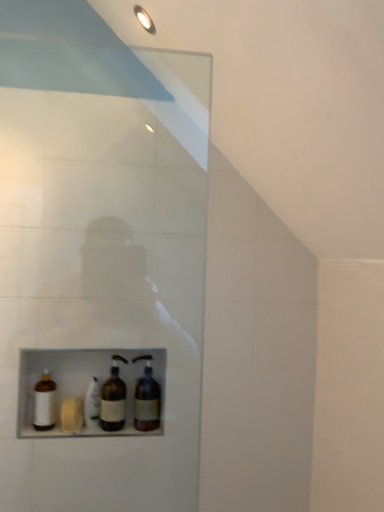
Question: Would you consider white matte bottle at center, acting as the third bottle starting from the right, to be distant from brown glass bottle at center, which is counted as the third bottle, starting from the left?

Choices:
 (A) yes
 (B) no

Answer: (B)

Question: Is brown glass bottle at center, which appears as the second bottle when viewed from the right, completely or partially inside white matte bottle at center, the second bottle from the left?

Choices:
 (A) no
 (B) yes

Answer: (A)

Question: Is white matte bottle at center, acting as the third bottle starting from the right, facing towards brown glass bottle at center, which appears as the second bottle when viewed from the right?

Choices:
 (A) yes
 (B) no

Answer: (B)

Question: Considering the relative sizes of white matte bottle at center, the second bottle from the left, and brown glass bottle at center, which appears as the second bottle when viewed from the right, in the image provided, is white matte bottle at center, the second bottle from the left, shorter than brown glass bottle at center, which appears as the second bottle when viewed from the right,?

Choices:
 (A) no
 (B) yes

Answer: (B)

Question: Does white matte bottle at center, acting as the third bottle starting from the right, have a smaller size compared to brown glass bottle at center, which appears as the second bottle when viewed from the right?

Choices:
 (A) yes
 (B) no

Answer: (A)

Question: Considering their positions, is white matte bottle at center, the second bottle from the left, located in front of or behind brown glass bottle at center, which is counted as the third bottle, starting from the left?

Choices:
 (A) behind
 (B) front

Answer: (A)

Question: Is white matte bottle at center, acting as the third bottle starting from the right, bigger or smaller than brown glass bottle at center, which is counted as the third bottle, starting from the left?

Choices:
 (A) small
 (B) big

Answer: (A)

Question: In the image, is white matte bottle at center, acting as the third bottle starting from the right, on the left side or the right side of brown glass bottle at center, which is counted as the third bottle, starting from the left?

Choices:
 (A) right
 (B) left

Answer: (B)

Question: Is white matte bottle at center, the second bottle from the left, situated inside brown glass bottle at center, which is counted as the third bottle, starting from the left, or outside?

Choices:
 (A) outside
 (B) inside

Answer: (A)

Question: From a real-world perspective, is white matte bottle at lower left, marked as the first bottle in a left-to-right arrangement, physically located above or below white matte bottle at center, the second bottle from the left?

Choices:
 (A) above
 (B) below

Answer: (A)

Question: Considering their positions, is white matte bottle at lower left, marked as the first bottle in a left-to-right arrangement, located in front of or behind white matte bottle at center, the second bottle from the left?

Choices:
 (A) front
 (B) behind

Answer: (A)

Question: Is white matte bottle at lower left, marked as the first bottle in a left-to-right arrangement, taller or shorter than white matte bottle at center, the second bottle from the left?

Choices:
 (A) tall
 (B) short

Answer: (B)

Question: Looking at the image, does white matte bottle at lower left, which is counted as the 4th bottle, starting from the right, seem bigger or smaller compared to white matte bottle at center, the second bottle from the left?

Choices:
 (A) big
 (B) small

Answer: (B)

Question: Considering their positions, is white matte bottle at center, acting as the third bottle starting from the right, located in front of or behind white matte bottle at lower left, marked as the first bottle in a left-to-right arrangement?

Choices:
 (A) front
 (B) behind

Answer: (B)

Question: From the image's perspective, is white matte bottle at center, the second bottle from the left, above or below white matte bottle at lower left, which is counted as the 4th bottle, starting from the right?

Choices:
 (A) above
 (B) below

Answer: (B)